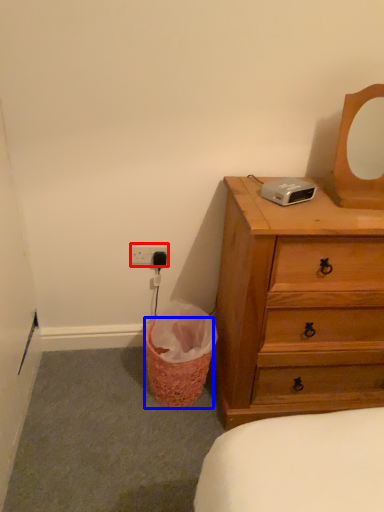
Question: Which of the following is the farthest to the observer, electric outlet (highlighted by a red box) or basket (highlighted by a blue box)?

Choices:
 (A) electric outlet
 (B) basket

Answer: (A)